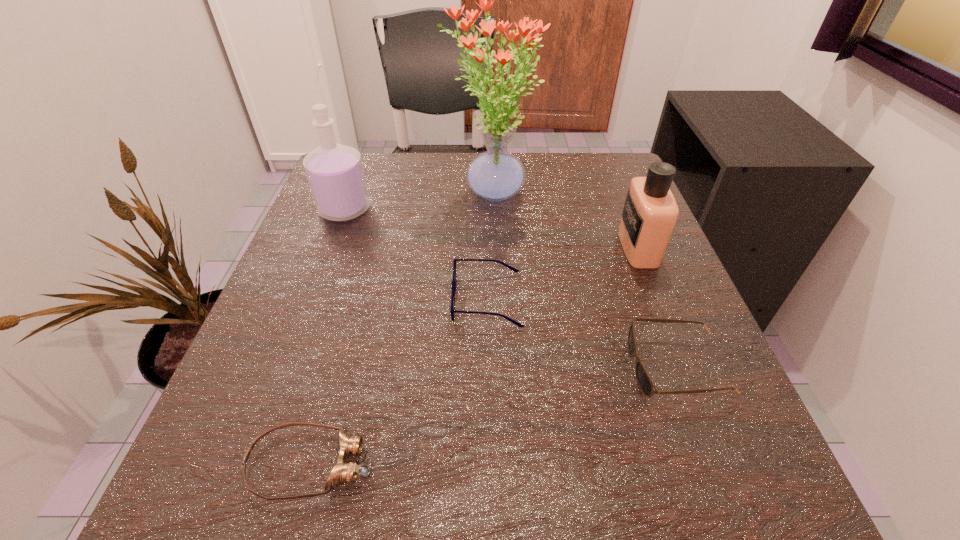
Where is `free location located 0.190m on the front lenses and sides of the nearest object`? This screenshot has height=540, width=960. free location located 0.190m on the front lenses and sides of the nearest object is located at coordinates (526, 463).

The height and width of the screenshot is (540, 960). Find the location of `flower arrangement that is positioned at the far edge`. flower arrangement that is positioned at the far edge is located at coordinates (495, 175).

At what (x,y) coordinates should I click in order to perform the action: click on perfume that is at the far edge. Please return your answer as a coordinate pair (x, y). The height and width of the screenshot is (540, 960). Looking at the image, I should click on (335, 173).

Where is `object at the near edge`? This screenshot has height=540, width=960. object at the near edge is located at coordinates (342, 472).

Find the location of `perfume that is at the left edge`. perfume that is at the left edge is located at coordinates (335, 173).

The height and width of the screenshot is (540, 960). I want to click on goggles present at the left edge, so click(x=342, y=472).

Image resolution: width=960 pixels, height=540 pixels. Find the location of `perfume positioned at the right edge`. perfume positioned at the right edge is located at coordinates (650, 212).

This screenshot has height=540, width=960. I want to click on sunglasses that is at the right edge, so click(646, 385).

You are a GUI agent. You are given a task and a screenshot of the screen. Output one action in this format:
    pyautogui.click(x=<x>, y=<y>)
    Task: Click on the object situated at the far left corner
    The width and height of the screenshot is (960, 540).
    Given the screenshot: What is the action you would take?
    pyautogui.click(x=335, y=173)

The image size is (960, 540). In order to click on object present at the near left corner in this screenshot , I will do `click(342, 472)`.